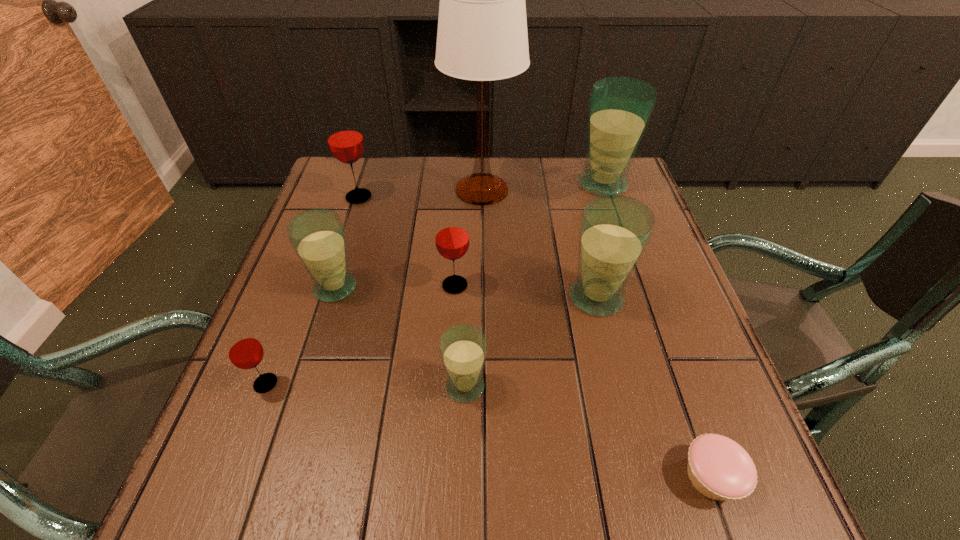
Where is `the smallest blue glass`? Image resolution: width=960 pixels, height=540 pixels. the smallest blue glass is located at coordinates (463, 348).

The width and height of the screenshot is (960, 540). I want to click on pink cupcake, so click(x=719, y=468).

This screenshot has width=960, height=540. I want to click on the shortest object, so click(x=719, y=468).

The width and height of the screenshot is (960, 540). What are the coordinates of `vacant point located above the cylindrical shade of the tallest object` in the screenshot? It's located at (328, 190).

The width and height of the screenshot is (960, 540). Find the location of `vacant area located 0.210m above the cylindrical shade of the tallest object`. vacant area located 0.210m above the cylindrical shade of the tallest object is located at coordinates (369, 190).

Find the location of a particular element. The image size is (960, 540). blank space located 0.290m above the cylindrical shade of the tallest object is located at coordinates (340, 190).

Where is `vacant space located on the front of the biggest blue glass`? vacant space located on the front of the biggest blue glass is located at coordinates (614, 219).

In order to click on free location located on the front of the farthest red glass in this screenshot , I will do `click(321, 315)`.

Find the location of a particular element. The height and width of the screenshot is (540, 960). vacant space located on the right of the third smallest blue glass is located at coordinates (673, 298).

Identify the location of blank space located on the back of the second smallest red glass. Image resolution: width=960 pixels, height=540 pixels. (458, 237).